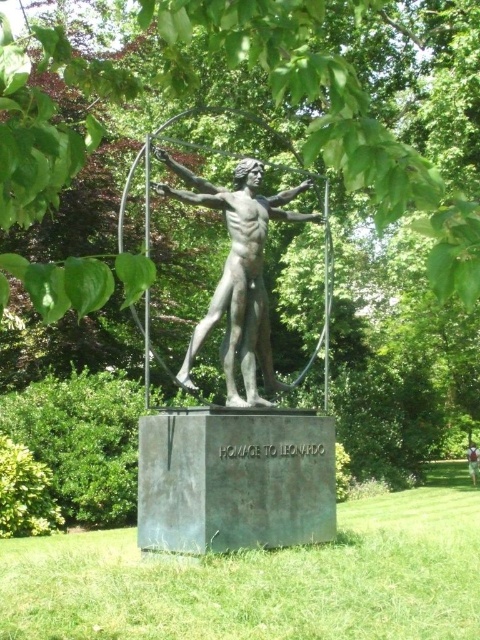
You are a photographer planning to take a closeup shot of the bronze statue at center and the light brown fabric shirt at center. Since you want both subjects to be clearly visible in the frame, which one should you focus on first to ensure proper focus? Please explain your reasoning based on their sizes.

The bronze statue at center is larger in size than the light brown fabric shirt at center. To ensure both are clearly visible, you should focus on the larger bronze statue at center first, as it requires more detailed focus due to its size, and then adjust for the smaller light brown fabric shirt at center.

You are an art student analyzing the statue and its components. Based on the scene, which object is taller between the bronze statue at center and the light brown fabric shirt at center?

The bronze statue at center is taller than the light brown fabric shirt at center.